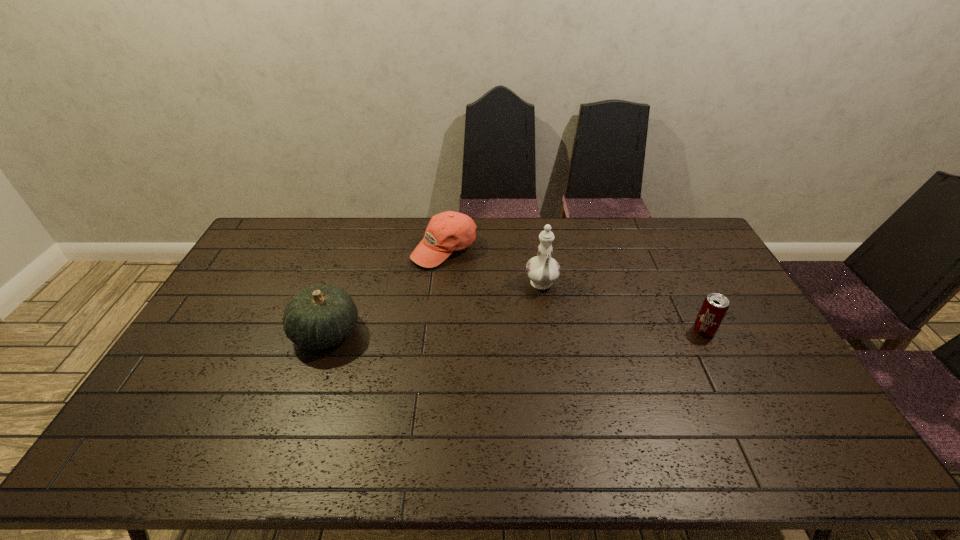
In the image, there is a desktop. Where is `vacant space at the right edge`? The image size is (960, 540). vacant space at the right edge is located at coordinates (752, 310).

Image resolution: width=960 pixels, height=540 pixels. What are the coordinates of `free location at the far left corner of the desktop` in the screenshot? It's located at (264, 228).

At what (x,y) coordinates should I click in order to perform the action: click on blank area at the near left corner. Please return your answer as a coordinate pair (x, y). The width and height of the screenshot is (960, 540). Looking at the image, I should click on (166, 415).

Identify the location of vacant region at the near right corner of the desktop. The height and width of the screenshot is (540, 960). (770, 394).

Identify the location of vacant area between the baseball cap and the gourd. The image size is (960, 540). click(x=385, y=291).

Where is `free spot between the third nearest object and the gourd`? This screenshot has height=540, width=960. free spot between the third nearest object and the gourd is located at coordinates (434, 309).

At what (x,y) coordinates should I click in order to perform the action: click on vacant space in between the leftmost object and the rightmost object. Please return your answer as a coordinate pair (x, y). Looking at the image, I should click on (515, 332).

You are a GUI agent. You are given a task and a screenshot of the screen. Output one action in this format:
    pyautogui.click(x=<x>, y=<y>)
    Task: Click on the vacant space that's between the tallest object and the gourd
    
    Given the screenshot: What is the action you would take?
    pyautogui.click(x=434, y=309)

Identify the location of empty location between the third object from right to left and the chinaware. (493, 267).

Where is `blank region between the leftmost object and the second farthest object`? blank region between the leftmost object and the second farthest object is located at coordinates (434, 309).